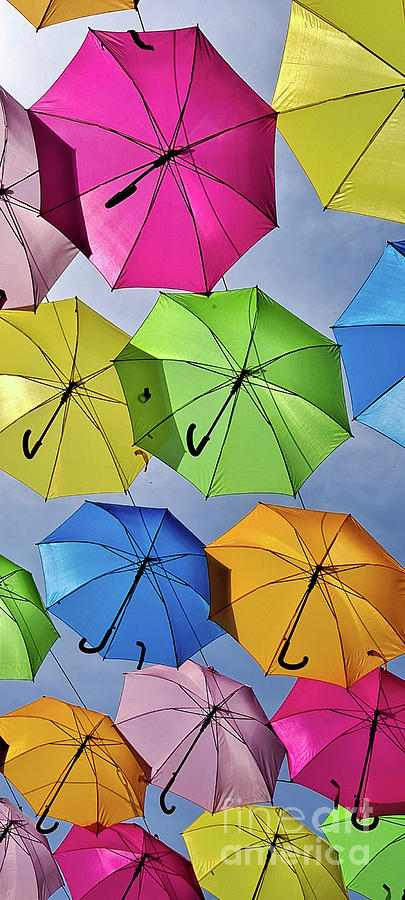
Locate an element on the screen. hook is located at coordinates (163, 801).